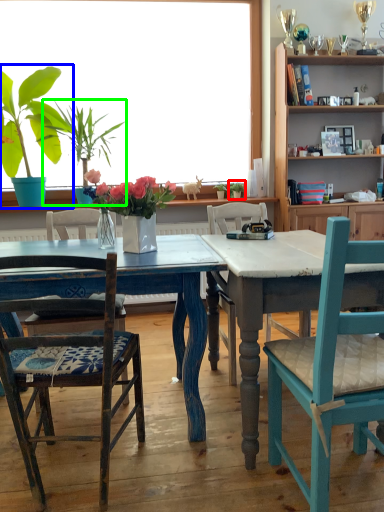
Question: Which object is the farthest from houseplant (highlighted by a red box)? Choose among these: houseplant (highlighted by a blue box) or houseplant (highlighted by a green box).

Choices:
 (A) houseplant
 (B) houseplant

Answer: (A)